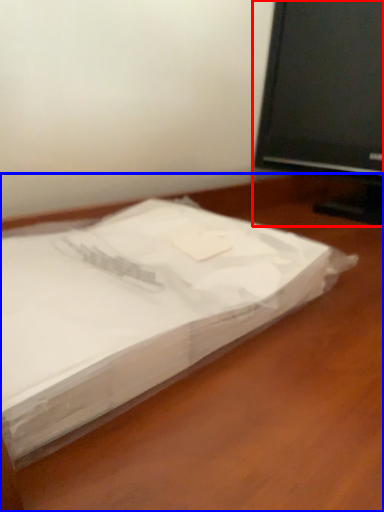
Question: Which of the following is the closest to the observer, television (highlighted by a red box) or desk (highlighted by a blue box)?

Choices:
 (A) television
 (B) desk

Answer: (B)